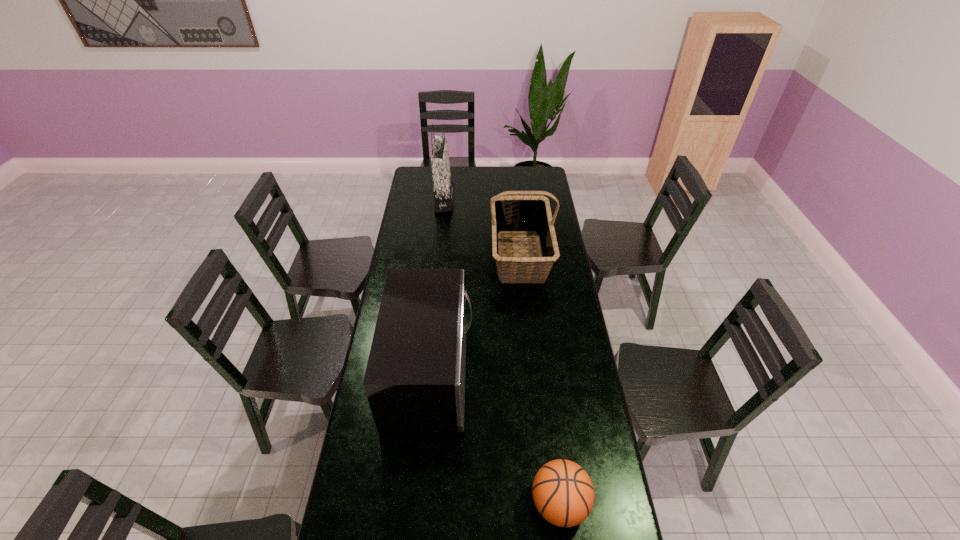
The width and height of the screenshot is (960, 540). I want to click on vacant position located 0.090m with the door open on the microwave oven, so click(495, 372).

Where is `blank space located on the back of the shortest object`? The image size is (960, 540). blank space located on the back of the shortest object is located at coordinates (553, 453).

The height and width of the screenshot is (540, 960). Identify the location of object present at the left edge. (414, 381).

The width and height of the screenshot is (960, 540). Find the location of `basket situated at the right edge`. basket situated at the right edge is located at coordinates (519, 214).

You are a GUI agent. You are given a task and a screenshot of the screen. Output one action in this format:
    pyautogui.click(x=<x>, y=<y>)
    Task: Click on the basketball that is at the right edge
    Image resolution: width=960 pixels, height=540 pixels.
    Given the screenshot: What is the action you would take?
    pyautogui.click(x=563, y=493)

The image size is (960, 540). I want to click on free space at the far edge of the desktop, so click(467, 173).

The width and height of the screenshot is (960, 540). Identify the location of vacant region at the left edge of the desktop. (407, 251).

Where is `vacant space at the right edge of the desktop`? The width and height of the screenshot is (960, 540). vacant space at the right edge of the desktop is located at coordinates (589, 364).

This screenshot has width=960, height=540. Find the location of `free spot between the third farthest object and the nearest object`. free spot between the third farthest object and the nearest object is located at coordinates (495, 438).

What are the coordinates of `unoccupied area between the shopping bag and the third shortest object` in the screenshot? It's located at (483, 227).